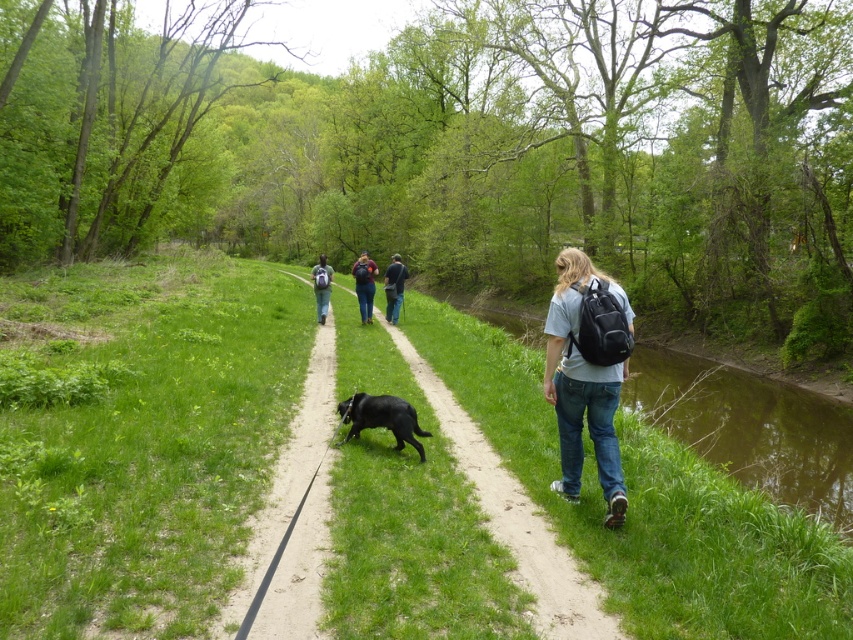
Is shiny black dog at center positioned behind matte black backpack at center?

No, it is in front of matte black backpack at center.

Does shiny black dog at center have a greater width compared to matte black backpack at center?

Incorrect, shiny black dog at center's width does not surpass matte black backpack at center's.

Describe the element at coordinates (381, 419) in the screenshot. I see `shiny black dog at center` at that location.

Where is `shiny black dog at center`? shiny black dog at center is located at coordinates (381, 419).

Does black rubber dog at center have a greater width compared to dirt path at center?

Correct, the width of black rubber dog at center exceeds that of dirt path at center.

Can you confirm if black rubber dog at center is positioned above dirt path at center?

Incorrect, black rubber dog at center is not positioned above dirt path at center.

This screenshot has height=640, width=853. Describe the element at coordinates (514, 516) in the screenshot. I see `black rubber dog at center` at that location.

The image size is (853, 640). In order to click on black rubber dog at center in this screenshot , I will do `click(514, 516)`.

Does matte blue jeans at center appear on the right side of dark blue jeans at center?

Incorrect, matte blue jeans at center is not on the right side of dark blue jeans at center.

Is matte blue jeans at center shorter than dark blue jeans at center?

Incorrect, matte blue jeans at center's height does not fall short of dark blue jeans at center's.

What do you see at coordinates (364, 284) in the screenshot? Image resolution: width=853 pixels, height=640 pixels. I see `matte blue jeans at center` at bounding box center [364, 284].

At what (x,y) coordinates should I click in order to perform the action: click on matte blue jeans at center. Please return your answer as a coordinate pair (x, y). The width and height of the screenshot is (853, 640). Looking at the image, I should click on (364, 284).